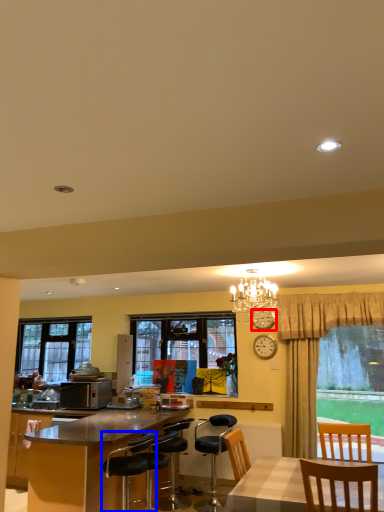
Question: Which of the following is the farthest to the observer, clock (highlighted by a red box) or chair (highlighted by a blue box)?

Choices:
 (A) clock
 (B) chair

Answer: (A)